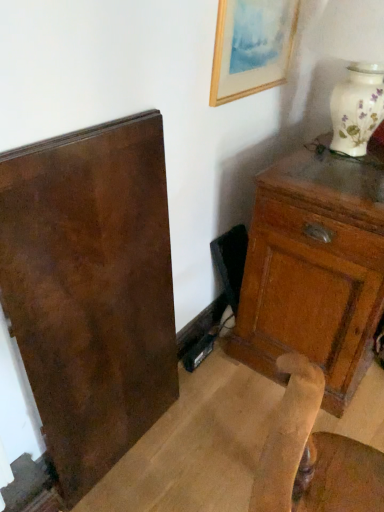
What do you see at coordinates (251, 47) in the screenshot?
I see `wooden framed painting at upper right` at bounding box center [251, 47].

Image resolution: width=384 pixels, height=512 pixels. I want to click on wooden framed painting at upper right, so click(x=251, y=47).

Find the location of a particular element. This screenshot has width=384, height=512. matte brown cabinet at right is located at coordinates (315, 267).

This screenshot has height=512, width=384. Describe the element at coordinates (315, 267) in the screenshot. I see `matte brown cabinet at right` at that location.

This screenshot has height=512, width=384. I want to click on wooden framed painting at upper right, so pos(251,47).

In the image, is matte brown cabinet at right on the left side or the right side of wooden framed painting at upper right?

matte brown cabinet at right is positioned on wooden framed painting at upper right's right side.

Is matte brown cabinet at right further to camera compared to wooden framed painting at upper right?

No.

Is point (286, 286) closer or farther from the camera than point (248, 54)?

Point (286, 286) is farther from the camera than point (248, 54).

From the image's perspective, which is above, matte brown cabinet at right or wooden framed painting at upper right?

wooden framed painting at upper right.

From a real-world perspective, is matte brown cabinet at right above or below wooden framed painting at upper right?

matte brown cabinet at right is below wooden framed painting at upper right.

Does matte brown cabinet at right have a lesser width compared to wooden framed painting at upper right?

Incorrect, the width of matte brown cabinet at right is not less than that of wooden framed painting at upper right.

In terms of height, does matte brown cabinet at right look taller or shorter compared to wooden framed painting at upper right?

Considering their sizes, matte brown cabinet at right has more height than wooden framed painting at upper right.

Who is smaller, matte brown cabinet at right or wooden framed painting at upper right?

With smaller size is wooden framed painting at upper right.

From the picture: Is matte brown cabinet at right not inside wooden framed painting at upper right?

Yes, matte brown cabinet at right is not within wooden framed painting at upper right.

Is matte brown cabinet at right in contact with wooden framed painting at upper right?

No, matte brown cabinet at right is not beside wooden framed painting at upper right.

Is matte brown cabinet at right aimed at wooden framed painting at upper right?

No, matte brown cabinet at right does not turn towards wooden framed painting at upper right.

How many degrees apart are the facing directions of matte brown cabinet at right and wooden framed painting at upper right?

matte brown cabinet at right and wooden framed painting at upper right are facing 93.3 degrees away from each other.

This screenshot has width=384, height=512. I want to click on the chest of drawers in front of the wooden framed painting at upper right, so click(315, 267).

Is wooden framed painting at upper right to the right of matte brown cabinet at right from the viewer's perspective?

In fact, wooden framed painting at upper right is to the left of matte brown cabinet at right.

Considering the positions of objects wooden framed painting at upper right and matte brown cabinet at right in the image provided, who is in front, wooden framed painting at upper right or matte brown cabinet at right?

Positioned in front is matte brown cabinet at right.

Does point (267, 71) come farther from viewer compared to point (285, 343)?

No, it is in front of (285, 343).

From the image's perspective, which one is positioned lower, wooden framed painting at upper right or matte brown cabinet at right?

matte brown cabinet at right, from the image's perspective.

From a real-world perspective, is wooden framed painting at upper right under matte brown cabinet at right?

Incorrect, from a real-world perspective, wooden framed painting at upper right is higher than matte brown cabinet at right.

Does wooden framed painting at upper right have a greater width compared to matte brown cabinet at right?

In fact, wooden framed painting at upper right might be narrower than matte brown cabinet at right.

From their relative heights in the image, would you say wooden framed painting at upper right is taller or shorter than matte brown cabinet at right?

Considering their sizes, wooden framed painting at upper right has less height than matte brown cabinet at right.

Considering the sizes of objects wooden framed painting at upper right and matte brown cabinet at right in the image provided, who is smaller, wooden framed painting at upper right or matte brown cabinet at right?

wooden framed painting at upper right is smaller.

Consider the image. Is wooden framed painting at upper right completely or partially outside of matte brown cabinet at right?

Yes, wooden framed painting at upper right is not within matte brown cabinet at right.

Is there a large distance between wooden framed painting at upper right and matte brown cabinet at right?

That's not correct — wooden framed painting at upper right is a little close to matte brown cabinet at right.

Is wooden framed painting at upper right positioned with its back to matte brown cabinet at right?

wooden framed painting at upper right is not turned away from matte brown cabinet at right.

What's the angular difference between wooden framed painting at upper right and matte brown cabinet at right's facing directions?

The angular difference between wooden framed painting at upper right and matte brown cabinet at right is 93.3 degrees.

Where is `picture frame above the matte brown cabinet at right (from a real-world perspective)`? This screenshot has height=512, width=384. picture frame above the matte brown cabinet at right (from a real-world perspective) is located at coordinates (251, 47).

Locate an element on the screen. This screenshot has height=512, width=384. chest of drawers in front of the wooden framed painting at upper right is located at coordinates (315, 267).

At what (x,y) coordinates should I click in order to perform the action: click on picture frame that is above the matte brown cabinet at right (from the image's perspective). Please return your answer as a coordinate pair (x, y). Image resolution: width=384 pixels, height=512 pixels. Looking at the image, I should click on (x=251, y=47).